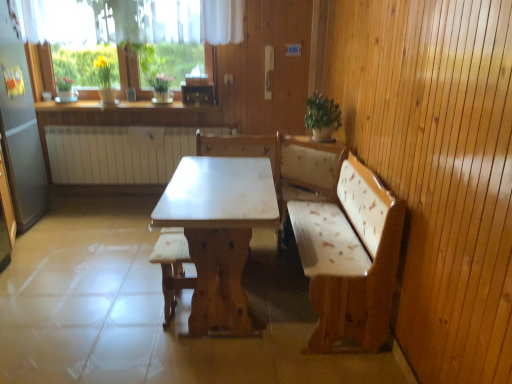
Where is `free spot above white marble table at center (from a real-world perspective)`? free spot above white marble table at center (from a real-world perspective) is located at coordinates (220, 182).